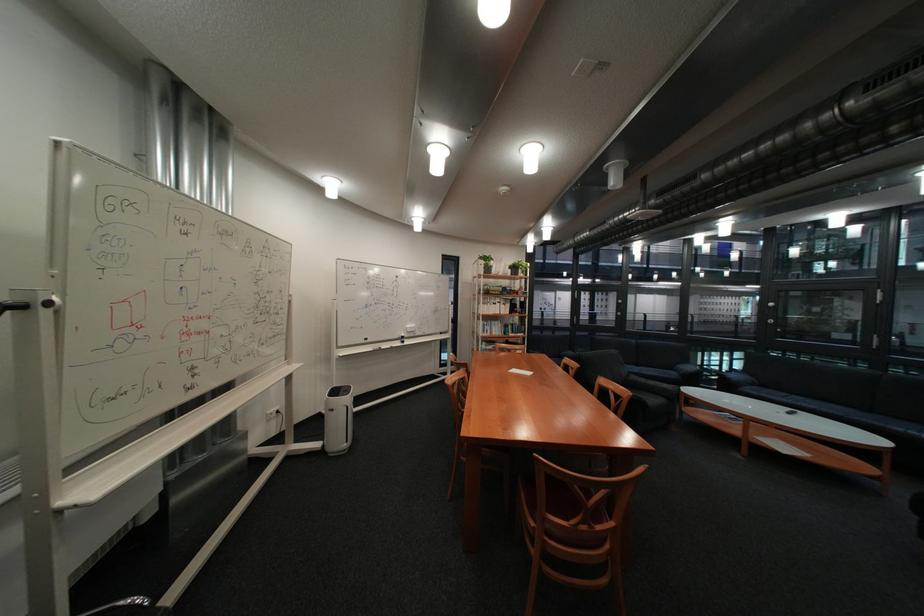
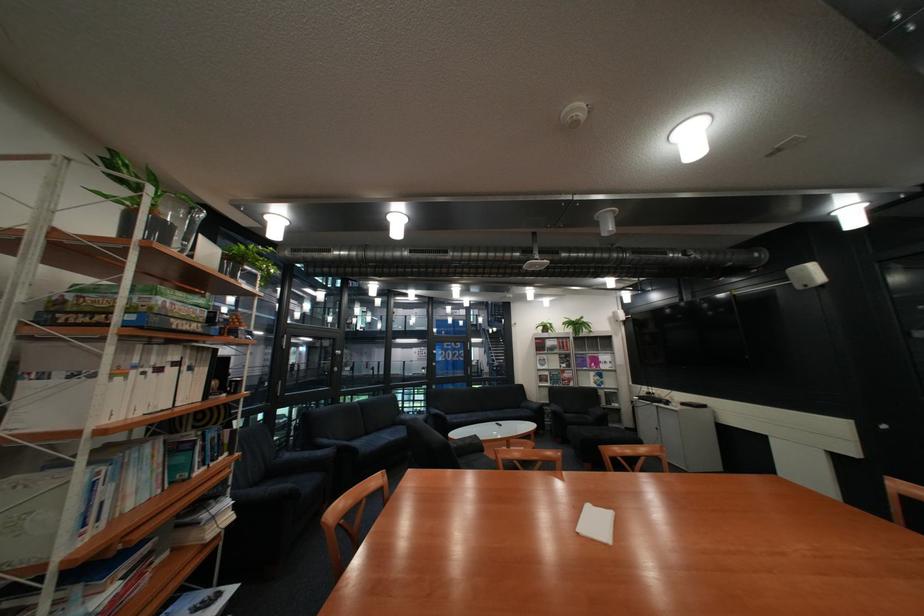
In the second image, find the point that corresponds to point (512, 323) in the first image.

(163, 448)